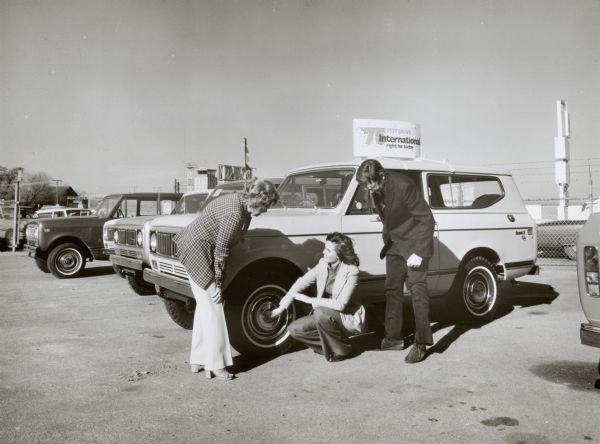
Identify the location of hood. (281, 211).